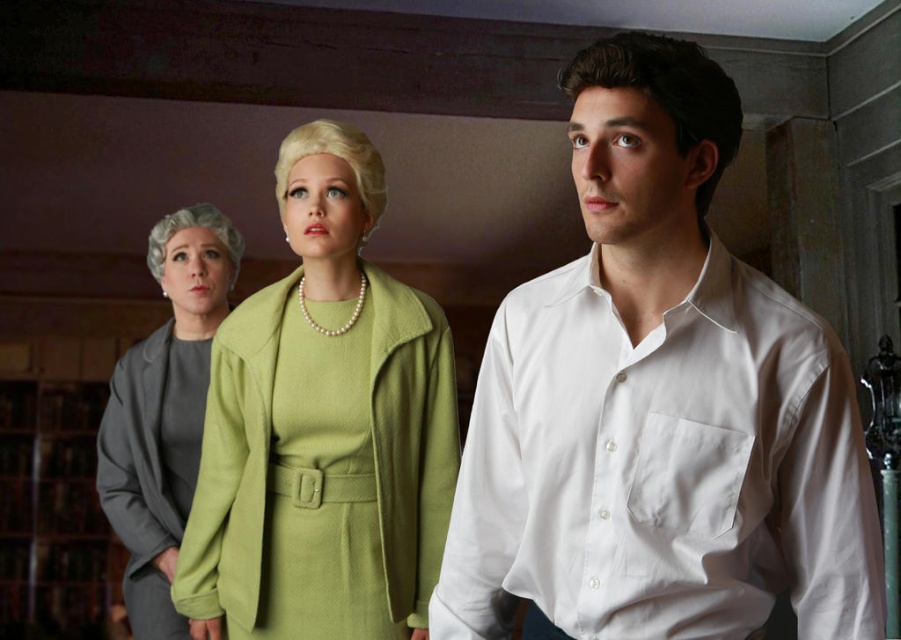
Between matte green dress at center and gray wool suit at left, which one appears on the right side from the viewer's perspective?

matte green dress at center is more to the right.

Between matte green dress at center and gray wool suit at left, which one appears on the left side from the viewer's perspective?

gray wool suit at left is more to the left.

Is point (413, 442) positioned in front of point (201, 211)?

Yes, it is in front of point (201, 211).

At what (x,y) coordinates should I click in order to perform the action: click on matte green dress at center. Please return your answer as a coordinate pair (x, y). This screenshot has width=901, height=640. Looking at the image, I should click on (323, 428).

Between white cotton shirt at center and matte green dress at center, which one has less height?

With less height is white cotton shirt at center.

Describe the element at coordinates (658, 404) in the screenshot. I see `white cotton shirt at center` at that location.

You are a GUI agent. You are given a task and a screenshot of the screen. Output one action in this format:
    pyautogui.click(x=<x>, y=<y>)
    Task: Click on the white cotton shirt at center
    The image size is (901, 640).
    Given the screenshot: What is the action you would take?
    pyautogui.click(x=658, y=404)

Consider the image. Can you confirm if white cotton shirt at center is positioned to the right of gray wool suit at left?

Indeed, white cotton shirt at center is positioned on the right side of gray wool suit at left.

Does white cotton shirt at center have a greater height compared to gray wool suit at left?

Incorrect, white cotton shirt at center's height is not larger of gray wool suit at left's.

This screenshot has height=640, width=901. In order to click on white cotton shirt at center in this screenshot , I will do `click(658, 404)`.